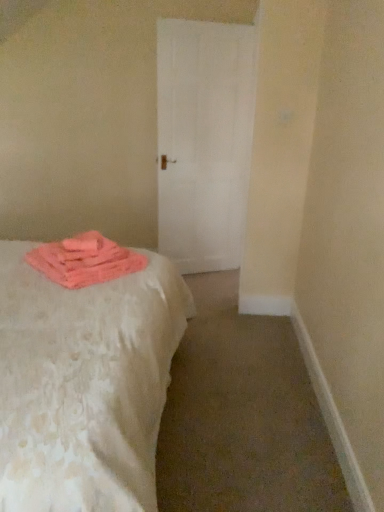
Question: Is white textured bed at left taller or shorter than white matte door at center?

Choices:
 (A) tall
 (B) short

Answer: (B)

Question: Is white textured bed at left bigger or smaller than white matte door at center?

Choices:
 (A) small
 (B) big

Answer: (B)

Question: Based on their relative distances, which object is farther from the white matte door at center?

Choices:
 (A) white textured bed at left
 (B) pink fluffy towel at lower left

Answer: (A)

Question: Which object is the farthest from the white matte door at center?

Choices:
 (A) white textured bed at left
 (B) pink fluffy towel at lower left

Answer: (A)